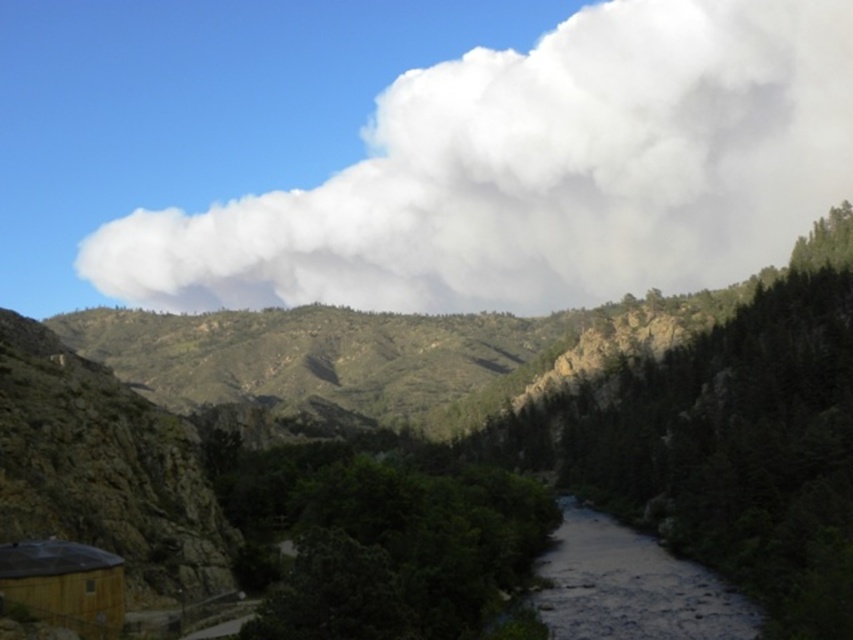
Question: Is white fluffy cloud at upper center thinner than dark gray smooth river at center?

Choices:
 (A) no
 (B) yes

Answer: (A)

Question: Which of the following is the farthest from the observer?

Choices:
 (A) dark gray smooth river at center
 (B) white fluffy cloud at upper center

Answer: (B)

Question: Observing the image, what is the correct spatial positioning of white fluffy cloud at upper center in reference to dark gray smooth river at center?

Choices:
 (A) left
 (B) right

Answer: (B)

Question: Where is dark gray smooth river at center located in relation to brown wooden hut at lower left in the image?

Choices:
 (A) above
 (B) below

Answer: (B)

Question: Which of the following is the closest to the observer?

Choices:
 (A) dark gray smooth river at center
 (B) brown wooden hut at lower left

Answer: (B)

Question: Which point appears farthest from the camera in this image?

Choices:
 (A) (13, 572)
 (B) (694, 628)
 (C) (384, 227)

Answer: (C)